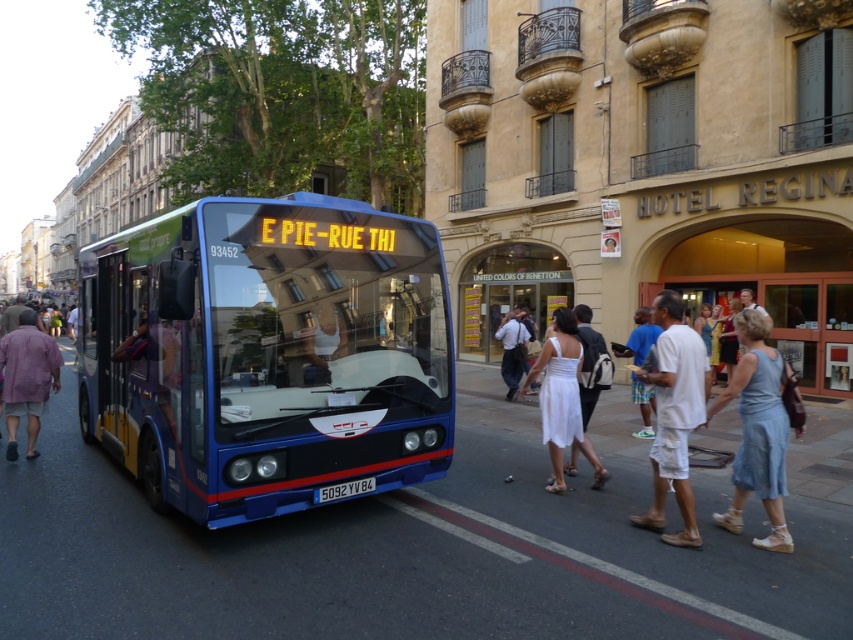
In the scene shown: You are a pedestrian standing at the center of the image. You see the blue public bus with route number E PIE on the left and the white cotton shorts at lower right. Which object is closer to the bottom edge of the image?

The white cotton shorts at lower right are closer to the bottom edge of the image because their position at point (674, 416) indicates they are lower on the frame.

You are a pedestrian standing on the sidewalk and see the blue metallic bus at center and the white cotton shorts at lower right. Which object is closer to the left side of the image?

The blue metallic bus at center is closer to the left side of the image because it is positioned to the left of the white cotton shorts at lower right.